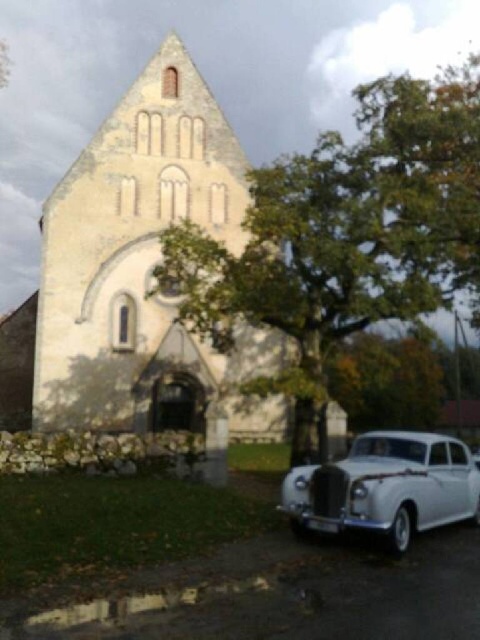
Question: Which of the following is the closest to the observer?

Choices:
 (A) light beige stone church at center
 (B) green leafy tree at center
 (C) white glossy sedan at lower right

Answer: (C)

Question: Observing the image, what is the correct spatial positioning of green leafy tree at center in reference to light beige stone church at center?

Choices:
 (A) above
 (B) below

Answer: (A)

Question: Does green leafy tree at center lie in front of white glossy sedan at lower right?

Choices:
 (A) no
 (B) yes

Answer: (A)

Question: Which object appears farthest from the camera in this image?

Choices:
 (A) white glossy sedan at lower right
 (B) light beige stone church at center

Answer: (B)

Question: Which object is closer to the camera taking this photo?

Choices:
 (A) white glossy sedan at lower right
 (B) light beige stone church at center

Answer: (A)

Question: Is light beige stone church at center wider than white glossy sedan at lower right?

Choices:
 (A) yes
 (B) no

Answer: (A)